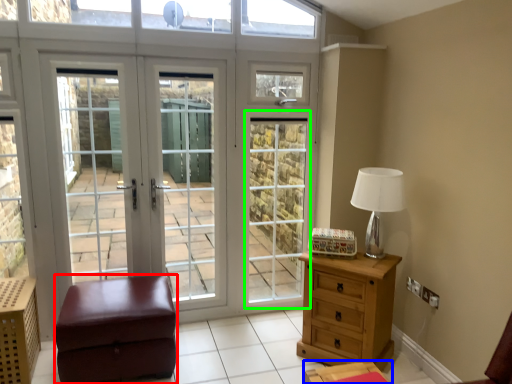
Question: Considering the real-world distances, which object is closest to furniture (highlighted by a red box)? nightstand (highlighted by a blue box) or screen door (highlighted by a green box).

Choices:
 (A) nightstand
 (B) screen door

Answer: (A)